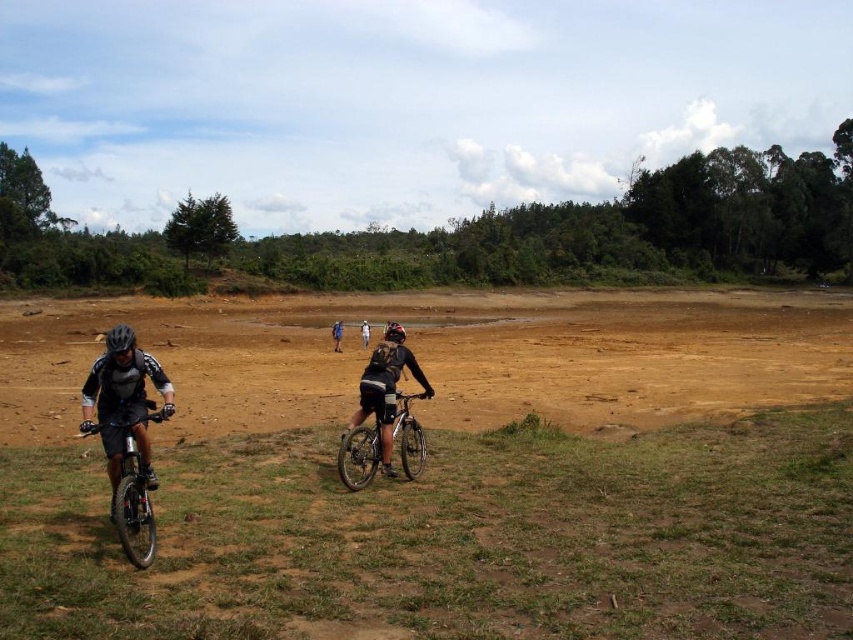
Question: From the image, what is the correct spatial relationship of brown sandy ground at center in relation to silver metallic bicycle at center?

Choices:
 (A) right
 (B) left

Answer: (A)

Question: Which object appears closest to the camera in this image?

Choices:
 (A) black matte bicycle helmet at left
 (B) blue fabric shorts at center

Answer: (A)

Question: Estimate the real-world distances between objects in this image. Which object is farther from the silver metallic bicycle at center?

Choices:
 (A) matte black helmet at center
 (B) black matte bicycle helmet at left
 (C) shiny metallic bicycle at lower left
 (D) black matte helmet at center

Answer: (D)

Question: Is shiny metallic bicycle at lower left closer to camera compared to matte black helmet at center?

Choices:
 (A) no
 (B) yes

Answer: (B)

Question: Is brown sandy ground at center further to camera compared to black matte helmet at center?

Choices:
 (A) yes
 (B) no

Answer: (B)

Question: Estimate the real-world distances between objects in this image. Which object is farther from the matte black helmet at center?

Choices:
 (A) brown sandy ground at center
 (B) shiny metallic bicycle at lower left

Answer: (A)